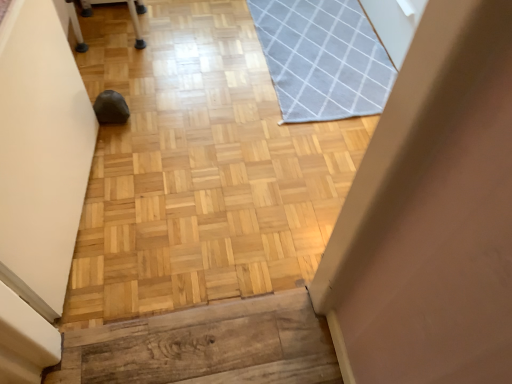
At what (x,y) coordinates should I click in order to perform the action: click on vacant location below gray woven mat at upper right (from a real-world perspective). Please return your answer as a coordinate pair (x, y). The height and width of the screenshot is (384, 512). Looking at the image, I should click on (325, 54).